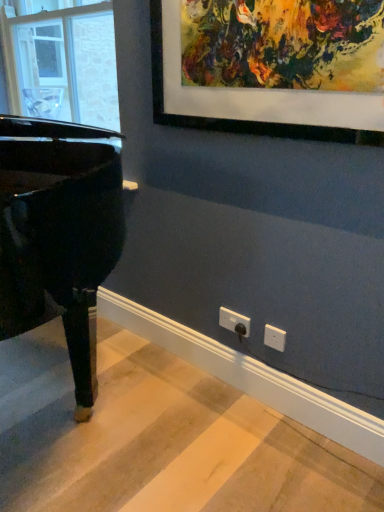
At what (x,y) coordinates should I click in order to perform the action: click on white plastic electric outlet at lower center. Please return your answer as a coordinate pair (x, y). This screenshot has width=384, height=512. Looking at the image, I should click on (234, 322).

This screenshot has width=384, height=512. What do you see at coordinates (62, 60) in the screenshot? I see `transparent glass window at left` at bounding box center [62, 60].

In order to face transparent glass window at left, should I rotate leftwards or rightwards?

To face it directly, rotate left by 17.438 degrees.

Describe the element at coordinates (58, 234) in the screenshot. This screenshot has width=384, height=512. I see `glossy black piano at left` at that location.

The width and height of the screenshot is (384, 512). I want to click on glossy black piano at left, so click(58, 234).

Locate an element on the screen. This screenshot has width=384, height=512. white plastic electric outlet at lower center is located at coordinates (234, 322).

Considering the points (52, 237) and (37, 92), which point is in front, point (52, 237) or point (37, 92)?

Point (52, 237)

Are glossy black piano at left and transparent glass window at left making contact?

glossy black piano at left is not next to transparent glass window at left, and they're not touching.

Is glossy black piano at left turned away from transparent glass window at left?

No, glossy black piano at left's orientation is not away from transparent glass window at left.

In the scene shown: Considering the relative positions of glossy black piano at left and transparent glass window at left in the image provided, is glossy black piano at left to the left or to the right of transparent glass window at left?

glossy black piano at left is positioned on transparent glass window at left's right side.

Identify the location of piano on the left of white plastic electric outlet at lower center. (58, 234).

Who is bigger, glossy black piano at left or white plastic electric outlet at lower center?

glossy black piano at left is bigger.

Is glossy black piano at left taller or shorter than white plastic electric outlet at lower center?

In the image, glossy black piano at left appears to be taller than white plastic electric outlet at lower center.

Based on the photo, from a real-world perspective, relative to white plastic electric outlet at lower center, is glossy black piano at left vertically above or below?

glossy black piano at left is situated higher than white plastic electric outlet at lower center in the real world.

How different are the orientations of white plastic electric outlet at lower center and transparent glass window at left in degrees?

white plastic electric outlet at lower center and transparent glass window at left are facing 0.169 degrees away from each other.

Based on the photo, would you say white plastic electric outlet at lower center is outside transparent glass window at left?

Yes, white plastic electric outlet at lower center is not within transparent glass window at left.

From the picture: Could you tell me if white plastic electric outlet at lower center is facing transparent glass window at left?

No, white plastic electric outlet at lower center is not oriented towards transparent glass window at left.

From the picture: How much distance is there between white plastic electric outlet at lower center and transparent glass window at left?

white plastic electric outlet at lower center is 1.63 meters away from transparent glass window at left.

Is transparent glass window at left inside or outside of white plastic electric outlet at lower center?

transparent glass window at left exists outside the volume of white plastic electric outlet at lower center.

Consider the image. What's the angular difference between transparent glass window at left and white plastic electric outlet at lower center's facing directions?

transparent glass window at left and white plastic electric outlet at lower center are facing 0.169 degrees away from each other.

The height and width of the screenshot is (512, 384). Identify the location of electric outlet on the right of the transparent glass window at left. (234, 322).

Which of these two, transparent glass window at left or white plastic electric outlet at lower center, stands taller?

transparent glass window at left is taller.

Which is nearer, (49, 102) or (93, 277)?

Point (49, 102) is positioned farther from the camera compared to point (93, 277).

Can you see transparent glass window at left touching glossy black piano at left?

There is a gap between transparent glass window at left and glossy black piano at left.

Where is `piano that appears below the transparent glass window at left (from a real-world perspective)`? This screenshot has width=384, height=512. piano that appears below the transparent glass window at left (from a real-world perspective) is located at coordinates (58, 234).

Does transparent glass window at left contain glossy black piano at left?

No, glossy black piano at left is not inside transparent glass window at left.

Visually, is white plastic electric outlet at lower center positioned to the left or to the right of glossy black piano at left?

Clearly, white plastic electric outlet at lower center is on the right of glossy black piano at left in the image.

Is white plastic electric outlet at lower center positioned far away from glossy black piano at left?

No.

From a real-world perspective, does white plastic electric outlet at lower center sit lower than glossy black piano at left?

Correct, in the physical world, white plastic electric outlet at lower center is lower than glossy black piano at left.

Is white plastic electric outlet at lower center closer to camera compared to glossy black piano at left?

No, white plastic electric outlet at lower center is further to the viewer.

Locate an element on the screen. window on the left of glossy black piano at left is located at coordinates [62, 60].

Where is `electric outlet below the glossy black piano at left (from the image's perspective)`? electric outlet below the glossy black piano at left (from the image's perspective) is located at coordinates (234, 322).

Considering their positions, is glossy black piano at left positioned further to transparent glass window at left than white plastic electric outlet at lower center?

white plastic electric outlet at lower center is positioned further to the anchor transparent glass window at left.

Based on their spatial positions, is glossy black piano at left or transparent glass window at left further from white plastic electric outlet at lower center?

The object further to white plastic electric outlet at lower center is transparent glass window at left.

Considering their positions, is transparent glass window at left positioned closer to white plastic electric outlet at lower center than glossy black piano at left?

The object closer to white plastic electric outlet at lower center is glossy black piano at left.

From the image, which object appears to be nearer to glossy black piano at left, transparent glass window at left or white plastic electric outlet at lower center?

white plastic electric outlet at lower center is positioned closer to the anchor glossy black piano at left.

Considering their positions, is white plastic electric outlet at lower center positioned further to transparent glass window at left than glossy black piano at left?

The object further to transparent glass window at left is white plastic electric outlet at lower center.

Based on their spatial positions, is white plastic electric outlet at lower center or transparent glass window at left closer to glossy black piano at left?

The object closer to glossy black piano at left is white plastic electric outlet at lower center.

This screenshot has height=512, width=384. I want to click on electric outlet between glossy black piano at left and transparent glass window at left along the z-axis, so click(x=234, y=322).